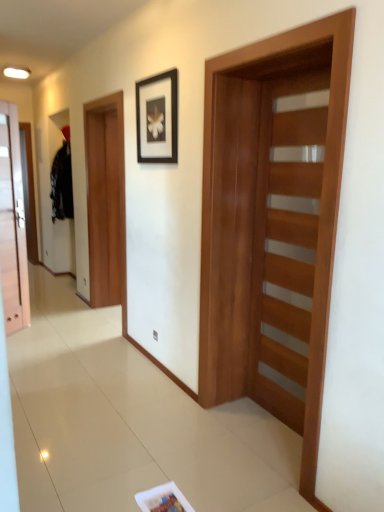
Question: Are black matte picture frame at upper center and wooden barn door at center, acting as the second barn door starting from the back, far apart?

Choices:
 (A) no
 (B) yes

Answer: (A)

Question: From a real-world perspective, is black matte picture frame at upper center located beneath wooden barn door at center, which ranks as the first barn door in right-to-left order?

Choices:
 (A) no
 (B) yes

Answer: (A)

Question: Is black matte picture frame at upper center outside wooden barn door at center, acting as the second barn door starting from the back?

Choices:
 (A) yes
 (B) no

Answer: (A)

Question: Considering the relative sizes of black matte picture frame at upper center and wooden barn door at center, which appears as the second barn door when viewed from the left, in the image provided, is black matte picture frame at upper center shorter than wooden barn door at center, which appears as the second barn door when viewed from the left,?

Choices:
 (A) yes
 (B) no

Answer: (A)

Question: Is black matte picture frame at upper center closer to camera compared to wooden barn door at center, acting as the 1th barn door starting from the front?

Choices:
 (A) no
 (B) yes

Answer: (A)

Question: Is the position of black matte picture frame at upper center more distant than that of wooden barn door at center, acting as the 1th barn door starting from the front?

Choices:
 (A) no
 (B) yes

Answer: (B)

Question: Can you confirm if black matte picture frame at upper center is thinner than wooden door at right, marked as the 1th door in a right-to-left arrangement?

Choices:
 (A) yes
 (B) no

Answer: (A)

Question: Is black matte picture frame at upper center positioned with its back to wooden door at right, the first door positioned from the front?

Choices:
 (A) no
 (B) yes

Answer: (A)

Question: Is black matte picture frame at upper center at the left side of wooden door at right, marked as the 1th door in a right-to-left arrangement?

Choices:
 (A) yes
 (B) no

Answer: (A)

Question: Considering the relative sizes of black matte picture frame at upper center and wooden door at right, the 2th door when ordered from left to right, in the image provided, is black matte picture frame at upper center bigger than wooden door at right, the 2th door when ordered from left to right,?

Choices:
 (A) no
 (B) yes

Answer: (A)

Question: From the image's perspective, is black matte picture frame at upper center under wooden door at right, the 2th door when ordered from left to right?

Choices:
 (A) yes
 (B) no

Answer: (B)

Question: Can you confirm if black matte picture frame at upper center is taller than wooden door at right, marked as the 1th door in a right-to-left arrangement?

Choices:
 (A) yes
 (B) no

Answer: (B)

Question: Is matte wood door at left, which is counted as the 1th door, starting from the left, positioned behind wooden barn door at center, which ranks as the first barn door in right-to-left order?

Choices:
 (A) yes
 (B) no

Answer: (A)